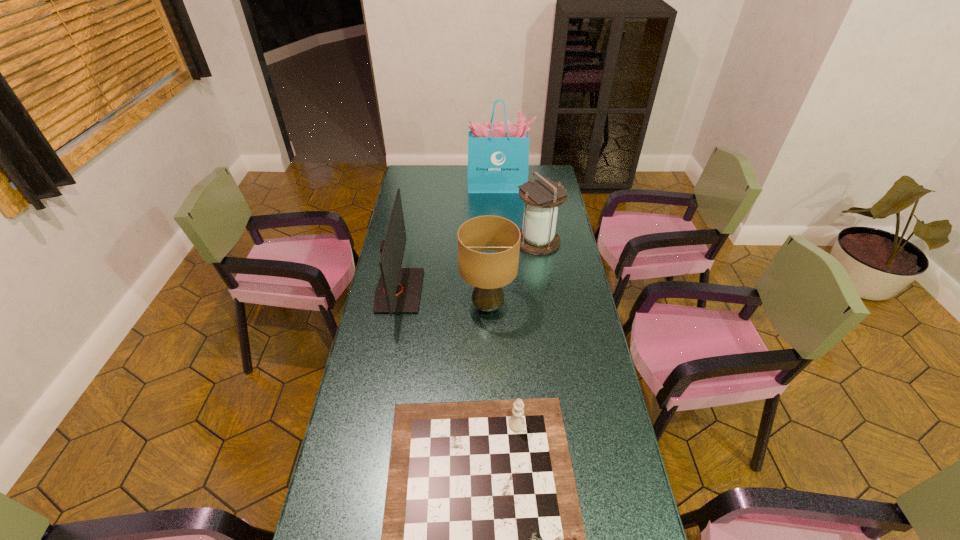
Where is `shopping bag`? The image size is (960, 540). shopping bag is located at coordinates (498, 153).

Locate an element on the screen. The height and width of the screenshot is (540, 960). the farthest object is located at coordinates (498, 153).

Locate an element on the screen. lampshade is located at coordinates (488, 272).

You are a GUI agent. You are given a task and a screenshot of the screen. Output one action in this format:
    pyautogui.click(x=<x>, y=<y>)
    Task: Click on the monitor
    This screenshot has width=960, height=540.
    Given the screenshot: What is the action you would take?
    pyautogui.click(x=398, y=290)

The image size is (960, 540). Find the location of `lantern`. lantern is located at coordinates (542, 197).

The width and height of the screenshot is (960, 540). What are the coordinates of `free space located on the front of the tallest object` in the screenshot? It's located at (500, 211).

At what (x,y) coordinates should I click in order to perform the action: click on vacant space located 0.210m on the right of the lampshade. Please return your answer as a coordinate pair (x, y). Looking at the image, I should click on (569, 307).

The height and width of the screenshot is (540, 960). What are the coordinates of `free space located 0.380m on the screen side of the monitor` in the screenshot? It's located at (516, 291).

Find the location of a particular element. This screenshot has width=960, height=540. free spot located 0.250m on the back of the lantern is located at coordinates (531, 198).

Identify the location of object that is at the far edge. The image size is (960, 540). [498, 153].